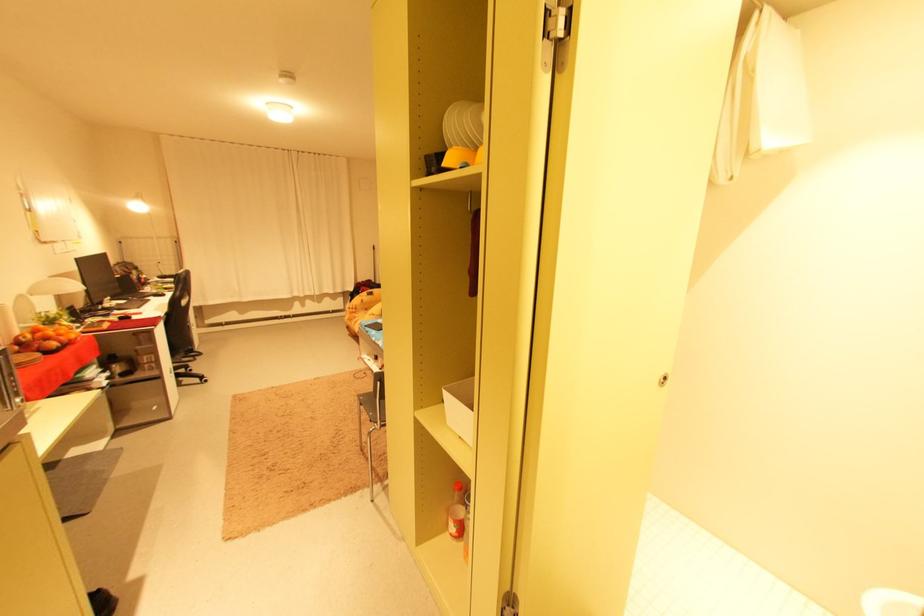
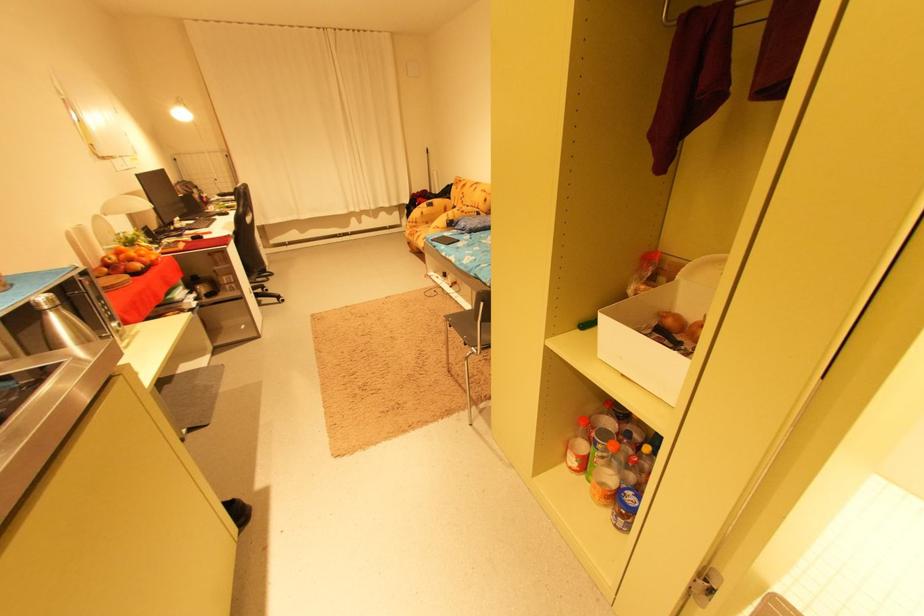
The point at (46, 334) is marked in the first image. Where is the corresponding point in the second image?

(129, 257)